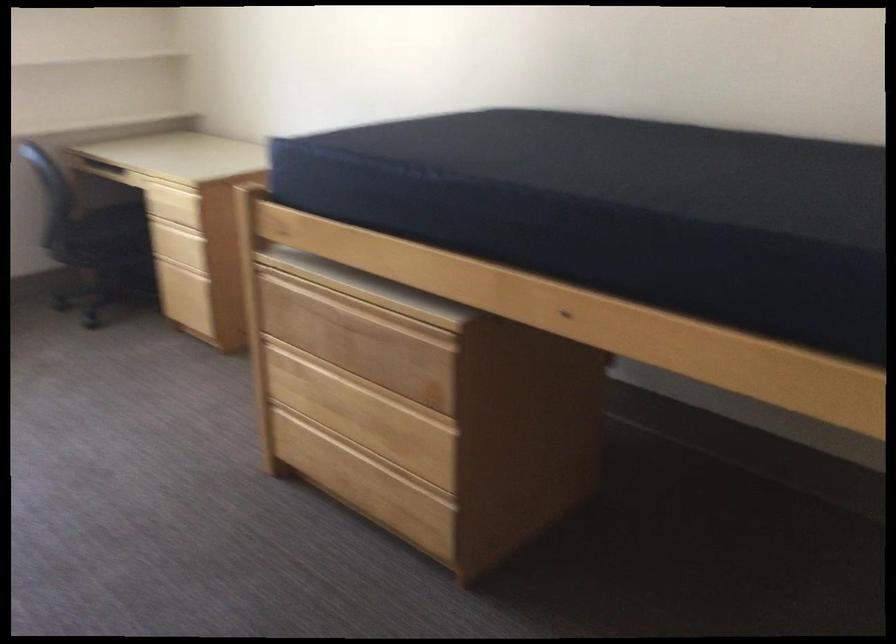
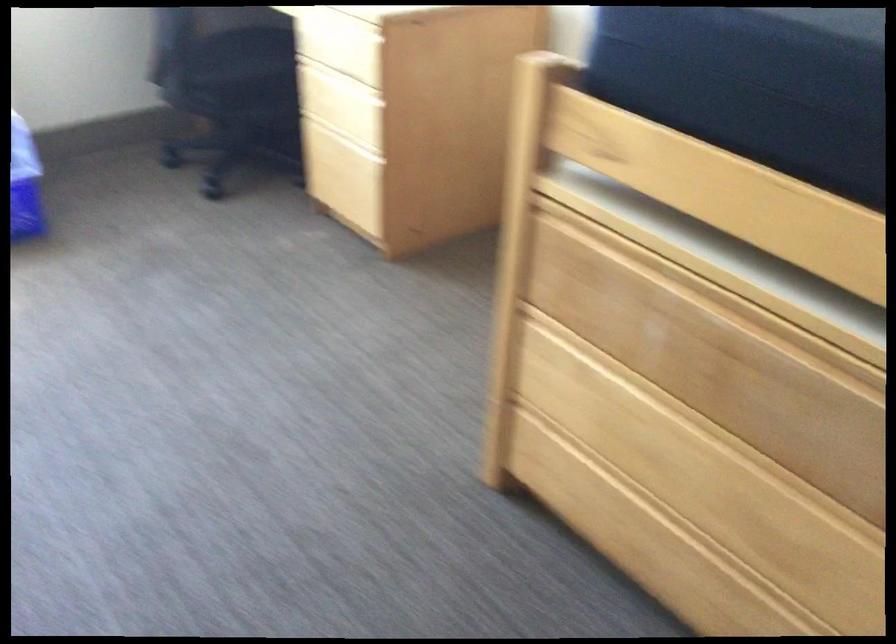
Which direction would the cameraman need to move to produce the second image?

The cameraman walked toward left, forward.